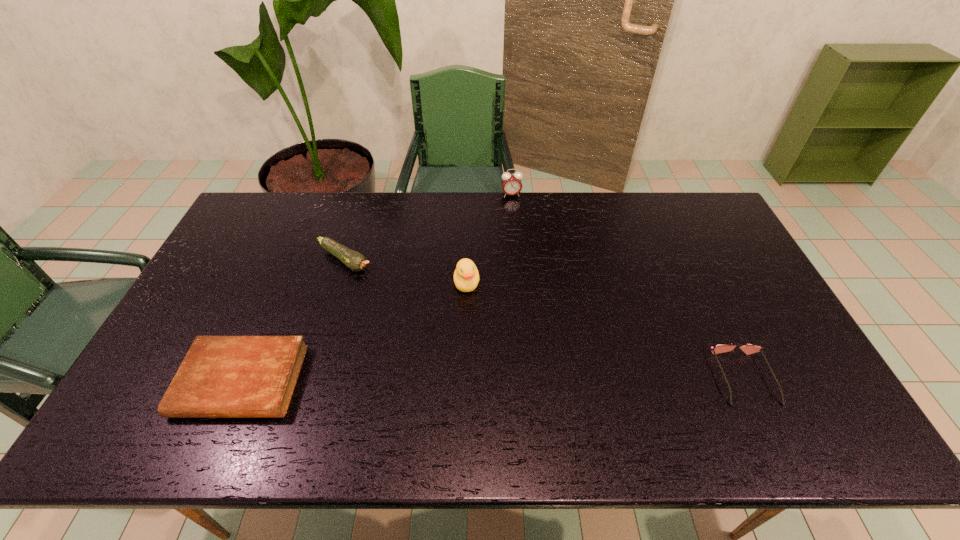
Image resolution: width=960 pixels, height=540 pixels. Find the location of `object that is at the near left corner`. object that is at the near left corner is located at coordinates (221, 376).

At what (x,y) coordinates should I click in order to perform the action: click on object that is at the near right corner. Please return your answer as a coordinate pair (x, y). Looking at the image, I should click on (749, 348).

I want to click on free spot at the far edge of the desktop, so click(458, 232).

Locate an element on the screen. vacant space at the near edge is located at coordinates (665, 380).

Where is `free space at the left edge of the desktop`? The image size is (960, 540). free space at the left edge of the desktop is located at coordinates (199, 335).

Where is `free space at the right edge of the desktop`? The width and height of the screenshot is (960, 540). free space at the right edge of the desktop is located at coordinates (707, 242).

Where is `free location at the far left corner`? This screenshot has height=540, width=960. free location at the far left corner is located at coordinates (284, 225).

Locate an element on the screen. This screenshot has width=960, height=540. unoccupied area between the fourth object from left to right and the sunglasses is located at coordinates (628, 286).

I want to click on free space between the Bible and the rightmost object, so click(x=492, y=380).

The height and width of the screenshot is (540, 960). Find the location of `empty space that is in between the alarm clock and the Bible`. empty space that is in between the alarm clock and the Bible is located at coordinates (376, 288).